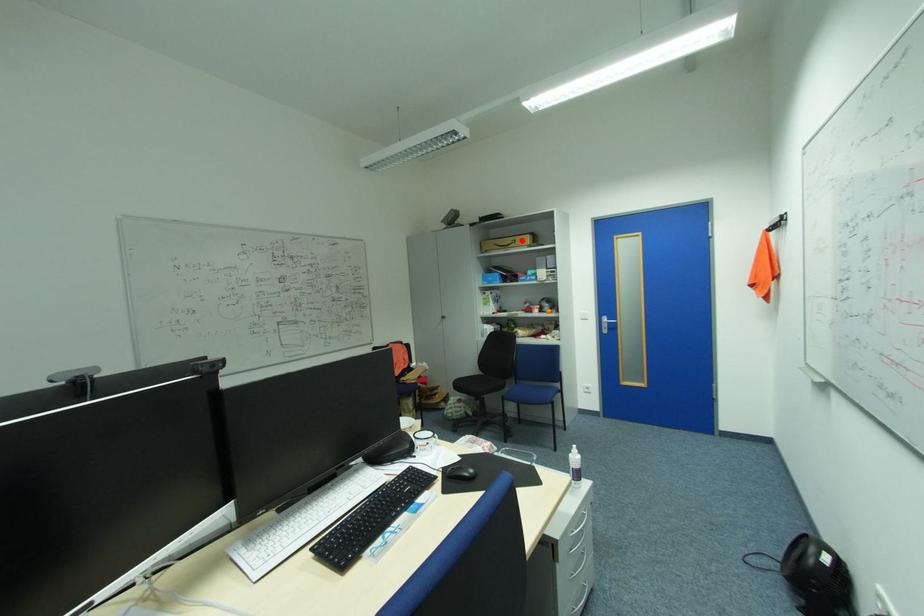
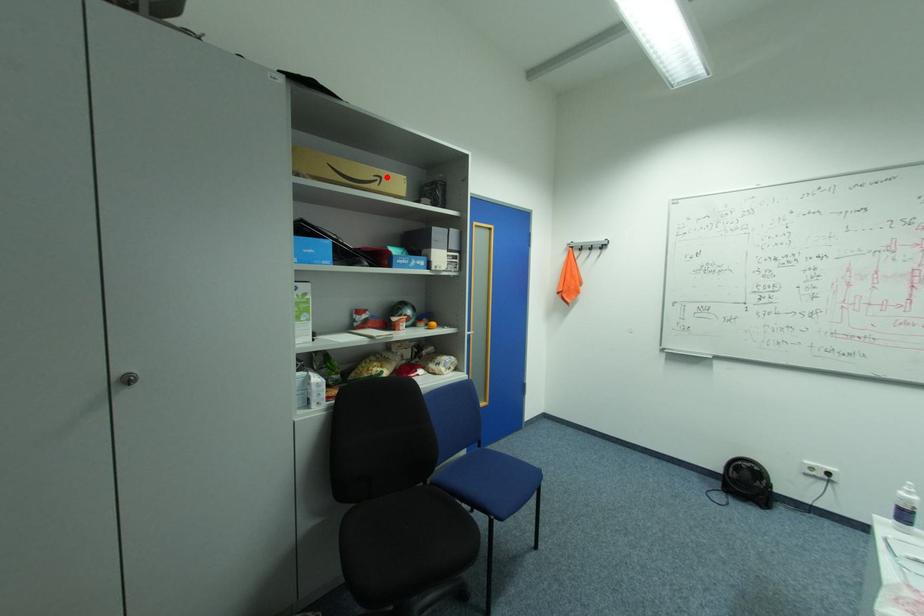
I am providing you with two images of the same scene from different viewpoints. A red point is marked on the first image and another point is marked on the second image. Do the highlighted points in image1 and image2 indicate the same real-world spot?

Yes